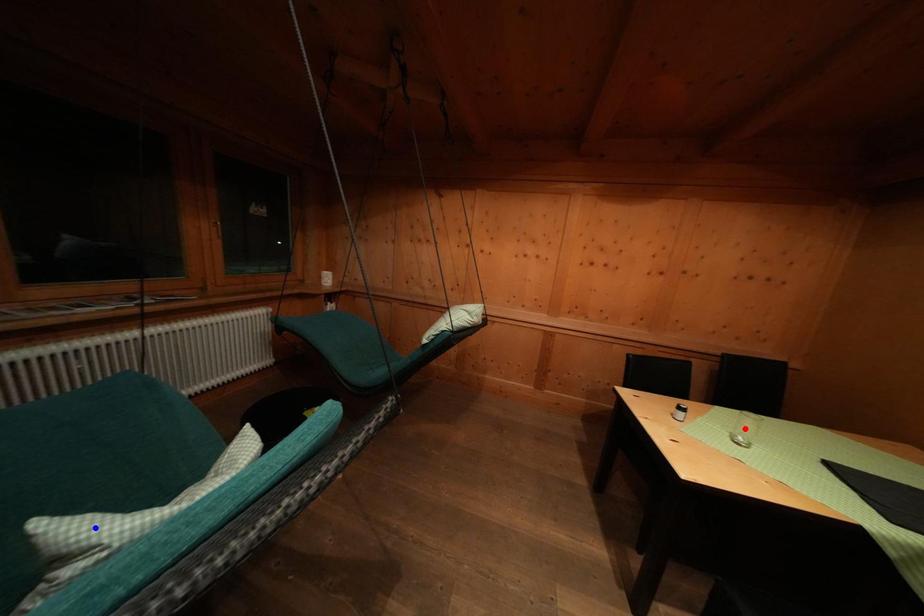
Question: Which of the two points in the image is closer to the camera?

Choices:
 (A) Blue point is closer.
 (B) Red point is closer.

Answer: (A)